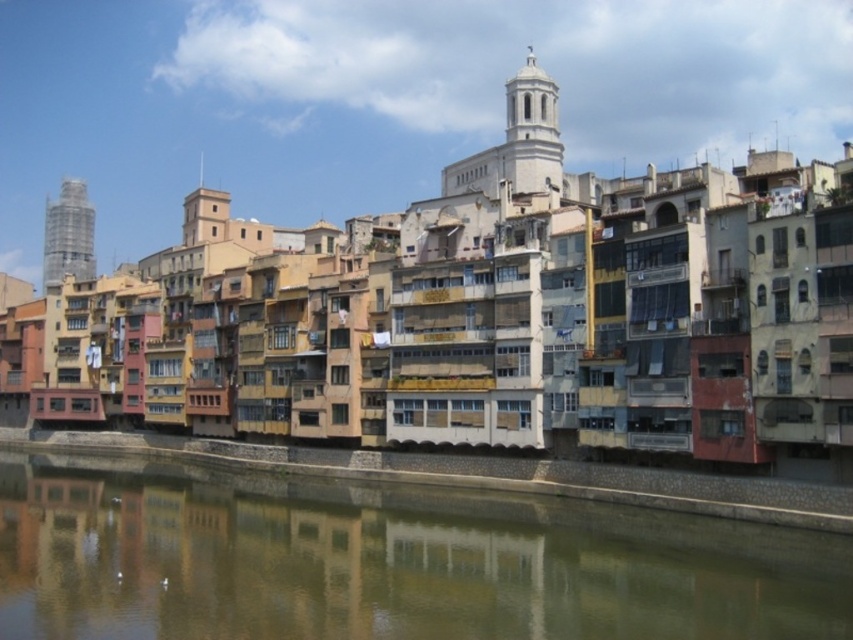
From the picture: You are standing at the riverside and want to take a photo of both the point at coordinates point (114, 480) and point (79, 204). Which point will appear larger in your photo?

Point (114, 480) will appear larger in the photo because it is closer to the camera than point (79, 204).

You are standing at the edge of the river in the urban riverside scene. There is a point marked at coordinates [384,561]. Where is this point located relative to the smooth concrete river at center?

The point is located on the smooth concrete river at center.

You are a tourist standing on the riverside path. You want to take a photo of the smooth gray concrete tower at left and the smooth concrete river at center. Which object should you position to your left side to capture both in the frame?

To capture both the smooth gray concrete tower at left and the smooth concrete river at center in your photo, position the smooth gray concrete tower at left to your left side since it is located to the left of the smooth concrete river at center.